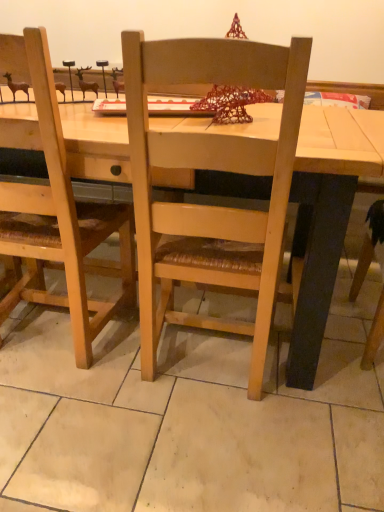
This screenshot has height=512, width=384. Find the location of `free space that is to the left of natural wood chair at center`. free space that is to the left of natural wood chair at center is located at coordinates (81, 371).